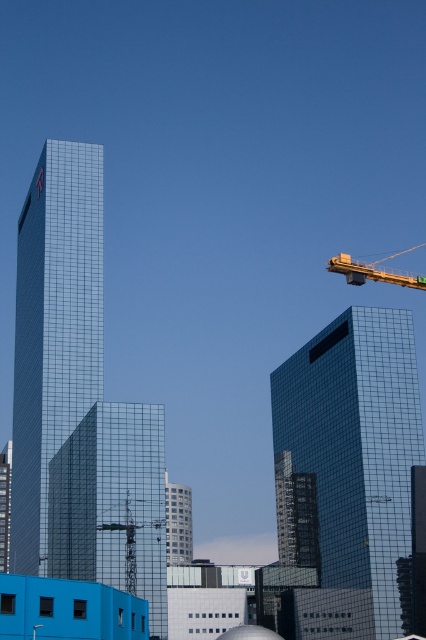
Question: Which point is closer to the camera?

Choices:
 (A) glossy glass tower at left
 (B) shiny glass building at center
 (C) shiny glass tower at center

Answer: (C)

Question: Which point is farther to the camera?

Choices:
 (A) shiny glass building at center
 (B) glossy glass tower at left

Answer: (B)

Question: Is glossy glass tower at left to the left of shiny glass tower at center from the viewer's perspective?

Choices:
 (A) no
 (B) yes

Answer: (B)

Question: Which of the following is the farthest from the observer?

Choices:
 (A) (388, 604)
 (B) (104, 426)

Answer: (B)

Question: Where is shiny glass building at center located in relation to glassy silver tower at center in the image?

Choices:
 (A) below
 (B) above

Answer: (B)

Question: Does shiny glass building at center lie in front of glossy glass tower at left?

Choices:
 (A) no
 (B) yes

Answer: (B)